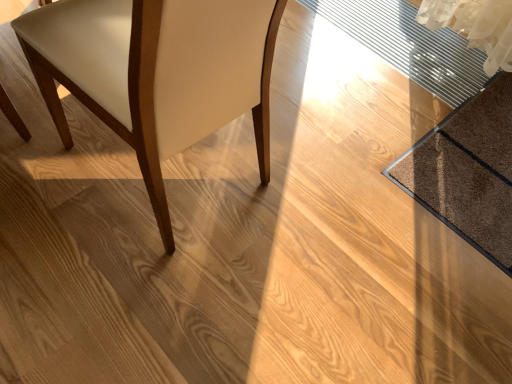
I want to click on free space in front of matte white chair at center, so click(124, 295).